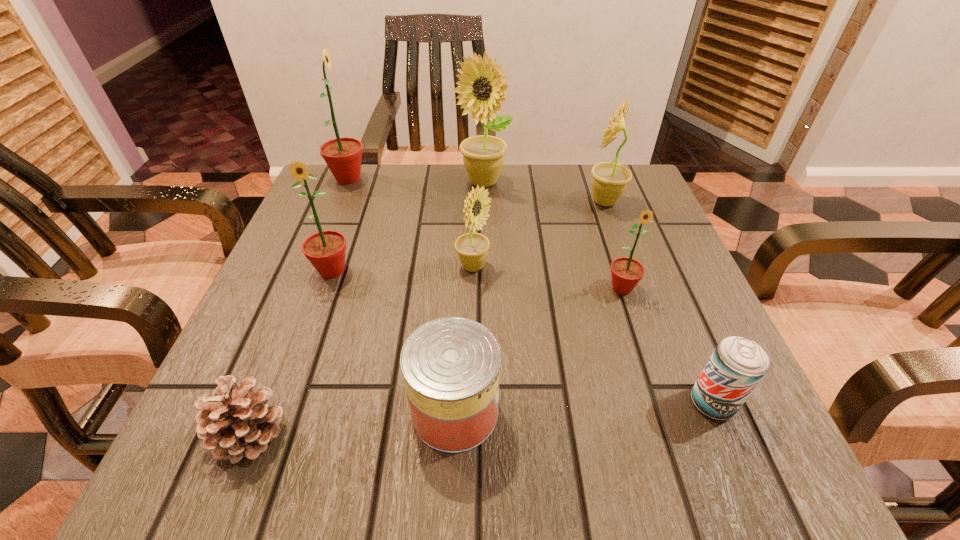
This screenshot has width=960, height=540. Find the location of `can situated at the near edge`. can situated at the near edge is located at coordinates (451, 366).

Locate an element on the screen. The height and width of the screenshot is (540, 960). beer can situated at the near edge is located at coordinates (737, 365).

Image resolution: width=960 pixels, height=540 pixels. In order to click on pinecone located at the near edge in this screenshot , I will do `click(237, 422)`.

Identify the location of pinecone situated at the left edge. (237, 422).

I want to click on beer can located in the right edge section of the desktop, so click(x=737, y=365).

The height and width of the screenshot is (540, 960). I want to click on object situated at the far left corner, so click(343, 156).

Image resolution: width=960 pixels, height=540 pixels. I want to click on object located at the near left corner, so click(237, 422).

Where is `object that is at the far right corner`? object that is at the far right corner is located at coordinates (609, 180).

The image size is (960, 540). I want to click on object that is at the near right corner, so click(x=737, y=365).

Identify the location of vacant space at the far edge of the desktop. This screenshot has height=540, width=960. (422, 210).